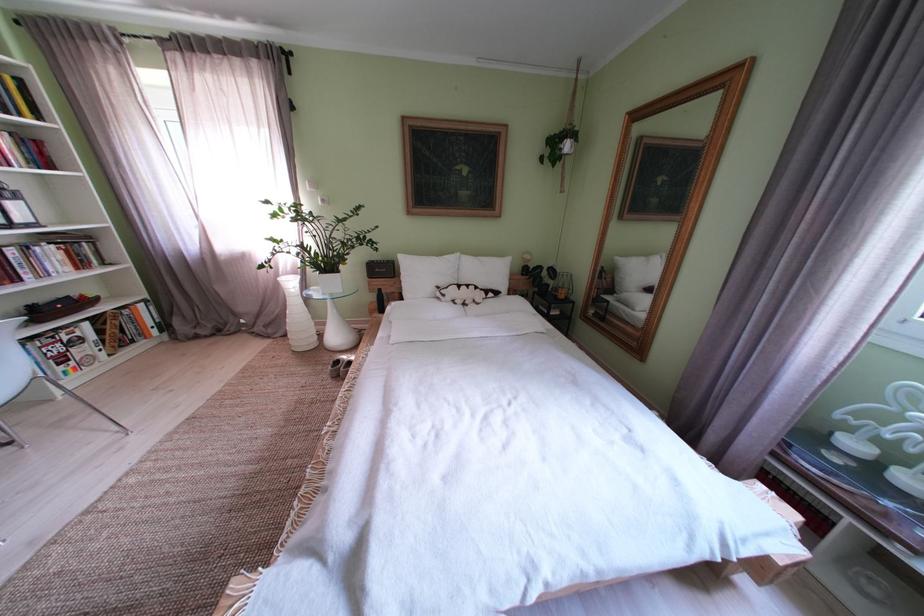
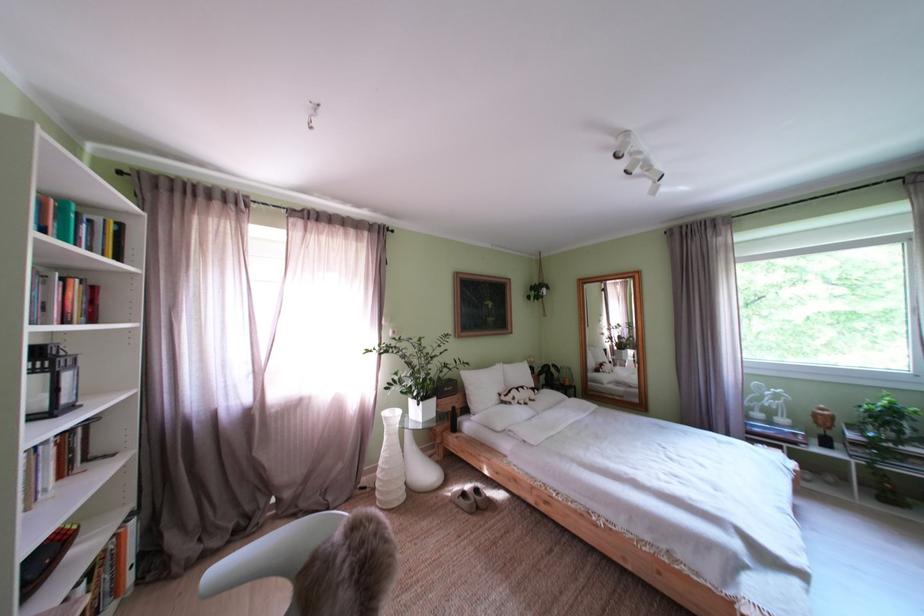
Where in the second image is the point corresponding to pixel 455 301 from the first image?

(525, 405)